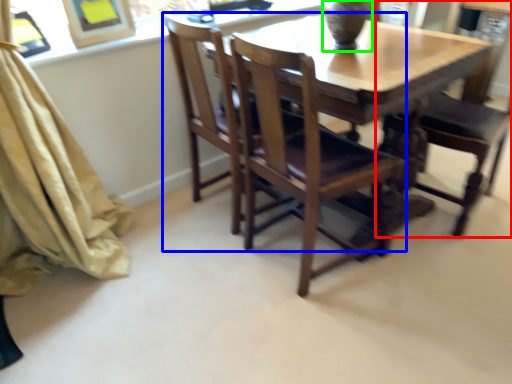
Question: Which is nearer to the chair (highlighted by a red box)? chair (highlighted by a blue box) or glass vase (highlighted by a green box).

Choices:
 (A) chair
 (B) glass vase

Answer: (A)